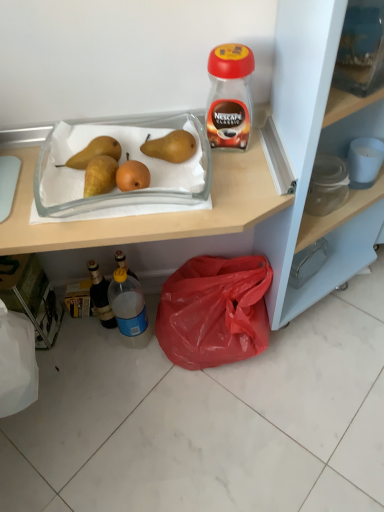
The width and height of the screenshot is (384, 512). What do you see at coordinates (247, 183) in the screenshot? I see `matte plastic bag at lower center` at bounding box center [247, 183].

Identify the location of brown matte pear at upper center, marked as the first pear in a right-to-left arrangement. The width and height of the screenshot is (384, 512). (171, 147).

The width and height of the screenshot is (384, 512). Find the location of `yellow matte pear at upper left, the 2th pear from the right`. yellow matte pear at upper left, the 2th pear from the right is located at coordinates (94, 152).

Image resolution: width=384 pixels, height=512 pixels. What do you see at coordinates (129, 309) in the screenshot? I see `translucent plastic bottle at lower left, which ranks as the second bottle in left-to-right order` at bounding box center [129, 309].

Where is `clear glass tray at center`? The image size is (384, 512). clear glass tray at center is located at coordinates (119, 165).

The width and height of the screenshot is (384, 512). Describe the element at coordinates (119, 165) in the screenshot. I see `clear glass tray at center` at that location.

Where is `matte plastic bag at lower center`? The width and height of the screenshot is (384, 512). matte plastic bag at lower center is located at coordinates (247, 183).

From a real-world perspective, is translucent plastic bottle at lower left, acting as the first bottle starting from the left, physically located above or below transparent glass jar at upper right?

translucent plastic bottle at lower left, acting as the first bottle starting from the left, is below transparent glass jar at upper right.

Considering the positions of objects translucent plastic bottle at lower left, acting as the first bottle starting from the left, and transparent glass jar at upper right in the image provided, who is more to the left, translucent plastic bottle at lower left, acting as the first bottle starting from the left, or transparent glass jar at upper right?

Positioned to the left is translucent plastic bottle at lower left, acting as the first bottle starting from the left.

Considering the sizes of translucent plastic bottle at lower left, acting as the first bottle starting from the left, and transparent glass jar at upper right in the image, is translucent plastic bottle at lower left, acting as the first bottle starting from the left, bigger or smaller than transparent glass jar at upper right?

Considering their sizes, translucent plastic bottle at lower left, acting as the first bottle starting from the left, takes up less space than transparent glass jar at upper right.

From a real-world perspective, relative to red plastic bag at lower right, is yellow matte pear at upper left, the 2th pear from the right, vertically above or below?

yellow matte pear at upper left, the 2th pear from the right, is above red plastic bag at lower right.

Is yellow matte pear at upper left, the first pear when ordered from left to right, far from red plastic bag at lower right?

No, yellow matte pear at upper left, the first pear when ordered from left to right, is in close proximity to red plastic bag at lower right.

Measure the distance between yellow matte pear at upper left, the 2th pear from the right, and red plastic bag at lower right.

The distance of yellow matte pear at upper left, the 2th pear from the right, from red plastic bag at lower right is 20.58 inches.

Can you confirm if yellow matte pear at upper left, the first pear when ordered from left to right, is bigger than red plastic bag at lower right?

No, yellow matte pear at upper left, the first pear when ordered from left to right, is not bigger than red plastic bag at lower right.

From a real-world perspective, is translucent plastic bottle at lower left, acting as the first bottle starting from the right, on top of matte plastic bag at lower center?

No, from a real-world perspective, translucent plastic bottle at lower left, acting as the first bottle starting from the right, is not over matte plastic bag at lower center

From the image's perspective, which is above, translucent plastic bottle at lower left, acting as the first bottle starting from the right, or matte plastic bag at lower center?

matte plastic bag at lower center is shown above in the image.

Is translucent plastic bottle at lower left, acting as the first bottle starting from the right, turned away from matte plastic bag at lower center?

Yes, translucent plastic bottle at lower left, acting as the first bottle starting from the right, is facing away from matte plastic bag at lower center.

Image resolution: width=384 pixels, height=512 pixels. In order to click on the 1st bottle counting from the left of the matte plastic bag at lower center in this screenshot , I will do `click(129, 309)`.

Does red plastic bag at lower right appear on the left side of matte plastic bag at lower center?

Incorrect, red plastic bag at lower right is not on the left side of matte plastic bag at lower center.

Is red plastic bag at lower right aimed at matte plastic bag at lower center?

Yes, red plastic bag at lower right is turned towards matte plastic bag at lower center.

Between red plastic bag at lower right and matte plastic bag at lower center, which one has more height?

With more height is matte plastic bag at lower center.

Considering the relative positions of brown matte pear at upper center, marked as the first pear in a right-to-left arrangement, and translucent plastic bottle at lower left, acting as the first bottle starting from the right, in the image provided, is brown matte pear at upper center, marked as the first pear in a right-to-left arrangement, to the left of translucent plastic bottle at lower left, acting as the first bottle starting from the right, from the viewer's perspective?

In fact, brown matte pear at upper center, marked as the first pear in a right-to-left arrangement, is to the right of translucent plastic bottle at lower left, acting as the first bottle starting from the right.

Between brown matte pear at upper center, positioned as the 2th pear in left-to-right order, and translucent plastic bottle at lower left, which ranks as the second bottle in left-to-right order, which one has larger size?

translucent plastic bottle at lower left, which ranks as the second bottle in left-to-right order.

Based on the photo, from the image's perspective, is brown matte pear at upper center, positioned as the 2th pear in left-to-right order, over translucent plastic bottle at lower left, acting as the first bottle starting from the right?

Yes, from the image's perspective, brown matte pear at upper center, positioned as the 2th pear in left-to-right order, is over translucent plastic bottle at lower left, acting as the first bottle starting from the right.

Could you measure the distance between brown matte pear at upper center, positioned as the 2th pear in left-to-right order, and translucent plastic bottle at lower left, acting as the first bottle starting from the right?

brown matte pear at upper center, positioned as the 2th pear in left-to-right order, is 48.81 centimeters from translucent plastic bottle at lower left, acting as the first bottle starting from the right.

From the image's perspective, is translucent plastic bottle at lower left, which ranks as the second bottle in left-to-right order, under transparent glass jar at upper right?

Correct, translucent plastic bottle at lower left, which ranks as the second bottle in left-to-right order, appears lower than transparent glass jar at upper right in the image.

Looking at this image, is translucent plastic bottle at lower left, which ranks as the second bottle in left-to-right order, touching transparent glass jar at upper right?

No, translucent plastic bottle at lower left, which ranks as the second bottle in left-to-right order, is not with transparent glass jar at upper right.

Between translucent plastic bottle at lower left, which ranks as the second bottle in left-to-right order, and transparent glass jar at upper right, which one is positioned behind?

translucent plastic bottle at lower left, which ranks as the second bottle in left-to-right order, is further from the camera.

Between translucent plastic bottle at lower left, acting as the first bottle starting from the right, and transparent glass jar at upper right, which one has smaller width?

transparent glass jar at upper right is thinner.

Considering their positions, is red plastic bag at lower right located in front of or behind brown matte pear at upper center, positioned as the 2th pear in left-to-right order?

red plastic bag at lower right is positioned farther from the viewer than brown matte pear at upper center, positioned as the 2th pear in left-to-right order.

Which of these two, red plastic bag at lower right or brown matte pear at upper center, positioned as the 2th pear in left-to-right order, is thinner?

With smaller width is brown matte pear at upper center, positioned as the 2th pear in left-to-right order.

Considering the relative sizes of red plastic bag at lower right and brown matte pear at upper center, marked as the first pear in a right-to-left arrangement, in the image provided, is red plastic bag at lower right smaller than brown matte pear at upper center, marked as the first pear in a right-to-left arrangement,?

Actually, red plastic bag at lower right might be larger than brown matte pear at upper center, marked as the first pear in a right-to-left arrangement.

Is red plastic bag at lower right next to brown matte pear at upper center, marked as the first pear in a right-to-left arrangement, and touching it?

No, red plastic bag at lower right is not touching brown matte pear at upper center, marked as the first pear in a right-to-left arrangement.

Where is `yoghurt that is above the translucent plastic bottle at lower left, acting as the first bottle starting from the left (from a real-world perspective)`? yoghurt that is above the translucent plastic bottle at lower left, acting as the first bottle starting from the left (from a real-world perspective) is located at coordinates [x=229, y=96].

Where is `plastic bag that is below the yellow matte pear at upper left, the 2th pear from the right (from the image's perspective)`? plastic bag that is below the yellow matte pear at upper left, the 2th pear from the right (from the image's perspective) is located at coordinates (214, 311).

From the image, which object appears to be nearer to red plastic bag at lower right, transparent glass jar at upper right or translucent plastic bottle at lower left, acting as the first bottle starting from the left?

translucent plastic bottle at lower left, acting as the first bottle starting from the left, is positioned closer to the anchor red plastic bag at lower right.

From the image, which object appears to be farther from yellow matte pear at upper left, the first pear when ordered from left to right, red plastic bag at lower right or brown matte pear at upper center, positioned as the 2th pear in left-to-right order?

red plastic bag at lower right lies further to yellow matte pear at upper left, the first pear when ordered from left to right, than the other object.

Estimate the real-world distances between objects in this image. Which object is closer to transparent glass jar at upper right, red plastic bag at lower right or yellow matte pear at upper left, the first pear when ordered from left to right?

yellow matte pear at upper left, the first pear when ordered from left to right.

Looking at this image, considering their positions, is brown matte pear at upper center, positioned as the 2th pear in left-to-right order, positioned closer to translucent plastic bottle at lower left, which ranks as the second bottle in left-to-right order, than translucent plastic bottle at lower left, the 2th bottle viewed from the right?

translucent plastic bottle at lower left, the 2th bottle viewed from the right, is closer to translucent plastic bottle at lower left, which ranks as the second bottle in left-to-right order.

Based on the photo, from the image, which object appears to be farther from clear glass tray at center, brown matte pear at upper center, positioned as the 2th pear in left-to-right order, or red plastic bag at lower right?

red plastic bag at lower right.

When comparing their distances from brown matte pear at upper center, positioned as the 2th pear in left-to-right order, does translucent plastic bottle at lower left, acting as the first bottle starting from the right, or translucent plastic bottle at lower left, the 2th bottle viewed from the right, seem closer?

translucent plastic bottle at lower left, acting as the first bottle starting from the right.

Looking at the image, which one is located further to brown matte pear at upper center, marked as the first pear in a right-to-left arrangement, red plastic bag at lower right or matte plastic bag at lower center?

The object further to brown matte pear at upper center, marked as the first pear in a right-to-left arrangement, is red plastic bag at lower right.

Which object lies nearer to the anchor point yellow matte pear at upper left, the 2th pear from the right, brown matte pear at upper center, positioned as the 2th pear in left-to-right order, or matte plastic bag at lower center?

Among the two, brown matte pear at upper center, positioned as the 2th pear in left-to-right order, is located nearer to yellow matte pear at upper left, the 2th pear from the right.

Image resolution: width=384 pixels, height=512 pixels. What are the coordinates of `yoghurt between matte plastic bag at lower center and translucent plastic bottle at lower left, the 2th bottle viewed from the right, along the z-axis` in the screenshot? It's located at (229, 96).

You are a GUI agent. You are given a task and a screenshot of the screen. Output one action in this format:
    pyautogui.click(x=<x>, y=<y>)
    Task: Click on the plastic bag between transparent glass jar at upper right and translucent plastic bottle at lower left, acting as the first bottle starting from the right, in the up-down direction
    The height and width of the screenshot is (512, 384).
    Given the screenshot: What is the action you would take?
    pyautogui.click(x=214, y=311)

In order to click on bottle between transparent glass jar at upper right and translucent plastic bottle at lower left, acting as the first bottle starting from the right, in the up-down direction in this screenshot , I will do `click(100, 295)`.

The image size is (384, 512). What are the coordinates of `bottle between yellow matte pear at upper left, the 2th pear from the right, and red plastic bag at lower right vertically` in the screenshot? It's located at (100, 295).